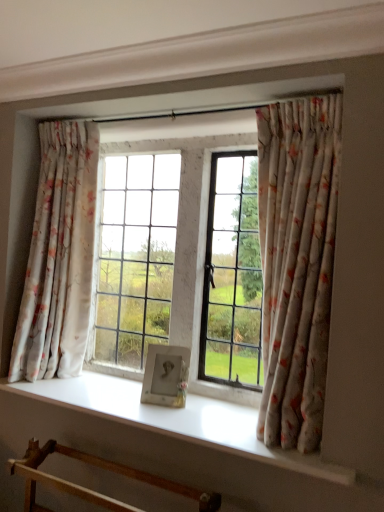
The image size is (384, 512). What are the coordinates of `free space above floral fabric curtain at right, marked as the first curtain in a right-to-left arrangement (from a real-world perspective)` in the screenshot? It's located at (296, 92).